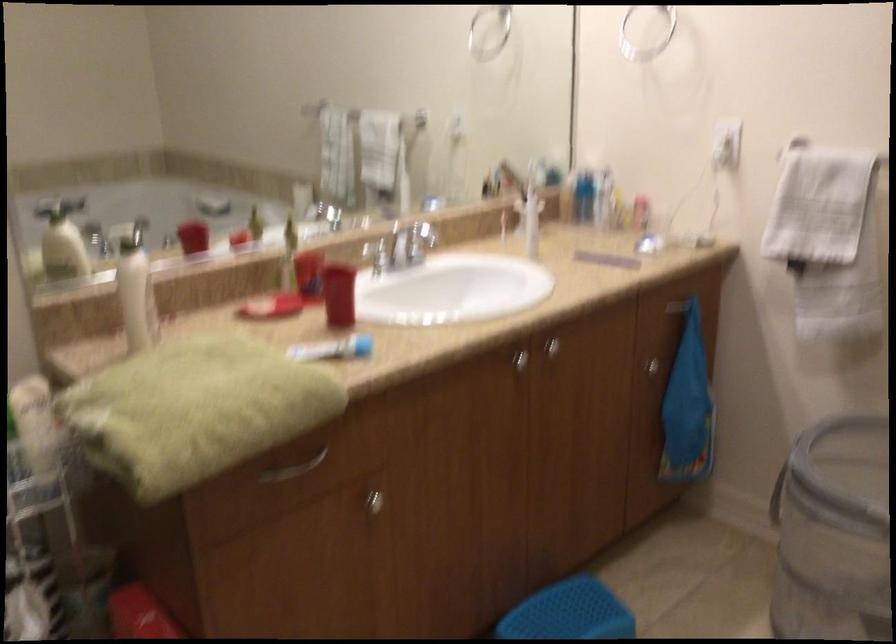
Find where to pull the silver drawer handle. Please return your answer as a coordinate pair (x, y).

(294, 468)